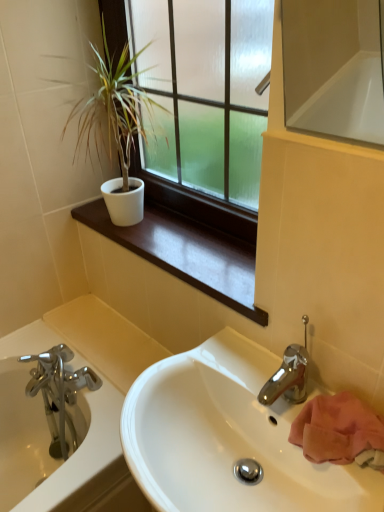
Image resolution: width=384 pixels, height=512 pixels. Identify the location of free space between matte glass window at upper center and white matte pot at upper left. (183, 250).